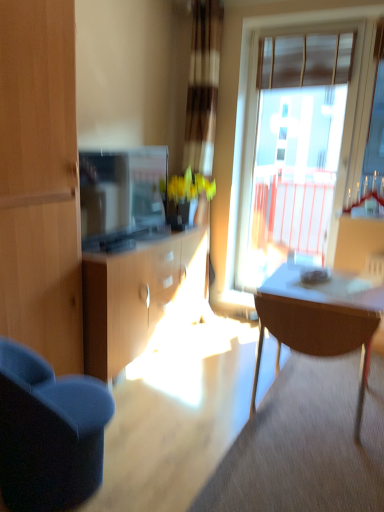
Question: Is translucent glass window at upper right situated inside matte brown table at right or outside?

Choices:
 (A) inside
 (B) outside

Answer: (B)

Question: From the image's perspective, relative to matte brown table at right, is translucent glass window at upper right above or below?

Choices:
 (A) below
 (B) above

Answer: (B)

Question: In terms of size, does translucent glass window at upper right appear bigger or smaller than matte brown table at right?

Choices:
 (A) big
 (B) small

Answer: (B)

Question: From the image's perspective, is matte brown table at right positioned above or below translucent glass window at upper right?

Choices:
 (A) above
 (B) below

Answer: (B)

Question: Considering the positions of matte brown table at right and translucent glass window at upper right in the image, is matte brown table at right wider or thinner than translucent glass window at upper right?

Choices:
 (A) thin
 (B) wide

Answer: (B)

Question: Is matte brown table at right in front of or behind translucent glass window at upper right in the image?

Choices:
 (A) behind
 (B) front

Answer: (B)

Question: Is matte brown table at right inside or outside of translucent glass window at upper right?

Choices:
 (A) outside
 (B) inside

Answer: (A)